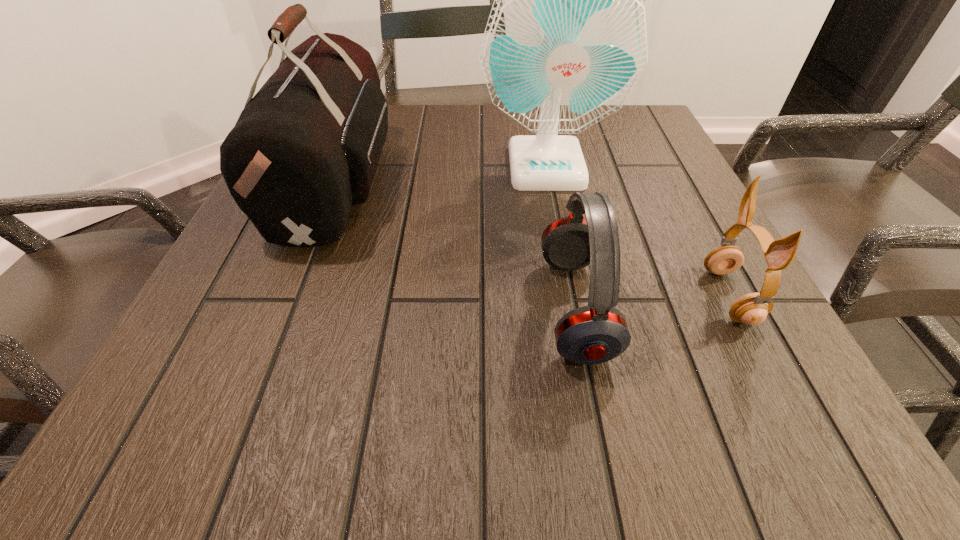
Where is `fan`? fan is located at coordinates (566, 40).

Locate an element on the screen. Image resolution: width=960 pixels, height=540 pixels. duffel bag is located at coordinates (305, 148).

At what (x,y) coordinates should I click in order to perform the action: click on the second tallest object. Please return your answer as a coordinate pair (x, y). The width and height of the screenshot is (960, 540). Looking at the image, I should click on (305, 148).

At what (x,y) coordinates should I click in order to perform the action: click on the left earphone. Please return your answer as a coordinate pair (x, y). This screenshot has width=960, height=540. Looking at the image, I should click on (593, 334).

Locate an element on the screen. the rightmost object is located at coordinates (752, 309).

Identify the location of vacant area located in front of the fan to face the airflow. The height and width of the screenshot is (540, 960). (557, 220).

Where is `vacant space located 0.150m on the front pocket of the leftmost object`? The image size is (960, 540). vacant space located 0.150m on the front pocket of the leftmost object is located at coordinates (461, 180).

At what (x,y) coordinates should I click in order to perform the action: click on vacant area located 0.060m on the ear cups of the left earphone. Please return your answer as a coordinate pair (x, y). The image size is (960, 540). Looking at the image, I should click on (505, 308).

Where is `blank space located on the ear cups of the left earphone`? blank space located on the ear cups of the left earphone is located at coordinates 414,308.

The image size is (960, 540). I want to click on vacant space located 0.240m on the ear cups of the left earphone, so click(x=388, y=308).